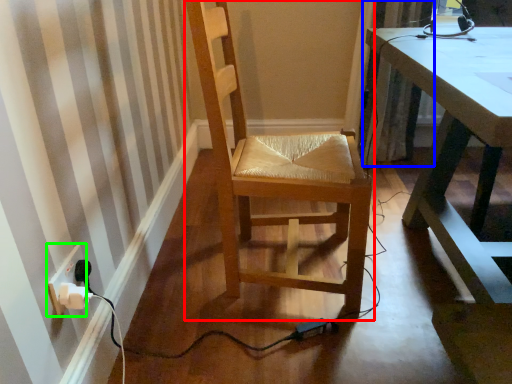
Question: Based on their relative distances, which object is farther from chair (highlighted by a red box)? Choose from curtain (highlighted by a blue box) and electric outlet (highlighted by a green box).

Choices:
 (A) curtain
 (B) electric outlet

Answer: (A)